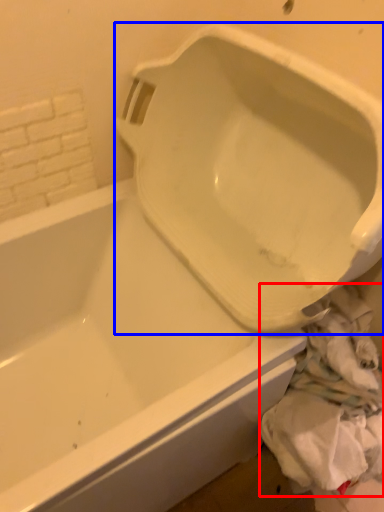
Question: Which point is further to the camera, material (highlighted by a red box) or urinal (highlighted by a blue box)?

Choices:
 (A) material
 (B) urinal

Answer: (A)